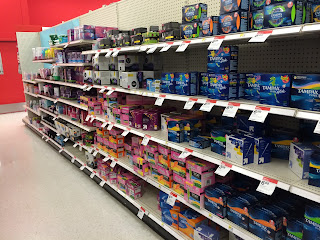
Where is `black base of the shelves`? The width and height of the screenshot is (320, 240). black base of the shelves is located at coordinates (159, 230).